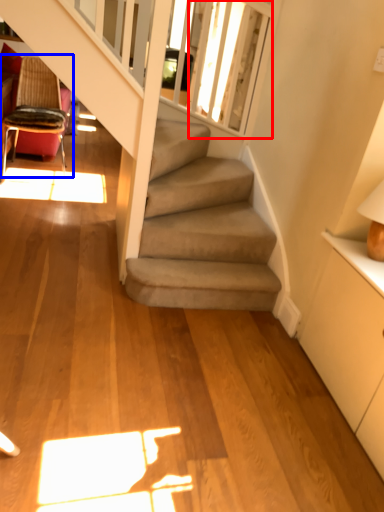
Question: Which of the following is the farthest to the observer, window screen (highlighted by a red box) or chair (highlighted by a blue box)?

Choices:
 (A) window screen
 (B) chair

Answer: (B)